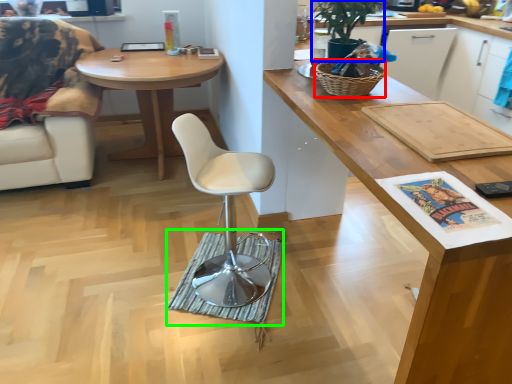
Question: Which object is the farthest from picnic basket (highlighted by a red box)? Choose among these: houseplant (highlighted by a blue box) or mat (highlighted by a green box).

Choices:
 (A) houseplant
 (B) mat

Answer: (B)